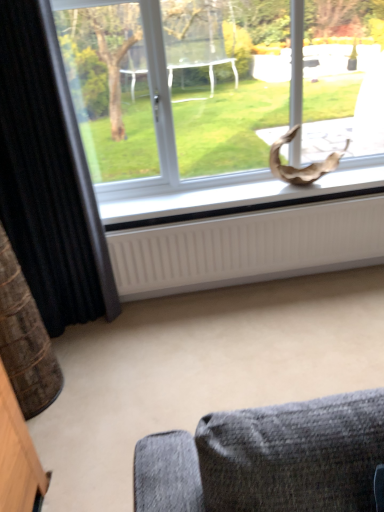
Question: From a real-world perspective, is white matte window sill at center positioned over transparent glass window at upper center based on gravity?

Choices:
 (A) yes
 (B) no

Answer: (B)

Question: Is white matte window sill at center surrounding transparent glass window at upper center?

Choices:
 (A) yes
 (B) no

Answer: (B)

Question: Does white matte window sill at center have a greater width compared to transparent glass window at upper center?

Choices:
 (A) yes
 (B) no

Answer: (B)

Question: From the image's perspective, is white matte window sill at center above transparent glass window at upper center?

Choices:
 (A) yes
 (B) no

Answer: (B)

Question: Considering the relative sizes of white matte window sill at center and transparent glass window at upper center in the image provided, is white matte window sill at center taller than transparent glass window at upper center?

Choices:
 (A) yes
 (B) no

Answer: (B)

Question: Is white ribbed radiator at lower center taller or shorter than black textured curtain at left?

Choices:
 (A) tall
 (B) short

Answer: (B)

Question: Is white ribbed radiator at lower center inside or outside of black textured curtain at left?

Choices:
 (A) outside
 (B) inside

Answer: (A)

Question: Is white ribbed radiator at lower center bigger or smaller than black textured curtain at left?

Choices:
 (A) big
 (B) small

Answer: (B)

Question: Is white ribbed radiator at lower center wider or thinner than black textured curtain at left?

Choices:
 (A) wide
 (B) thin

Answer: (B)

Question: Relative to transparent glass window at upper center, is white matte window sill at center in front or behind?

Choices:
 (A) behind
 (B) front

Answer: (A)

Question: Is point pos(365,172) closer or farther from the camera than point pos(157,90)?

Choices:
 (A) farther
 (B) closer

Answer: (A)

Question: From their relative heights in the image, would you say white matte window sill at center is taller or shorter than transparent glass window at upper center?

Choices:
 (A) tall
 (B) short

Answer: (B)

Question: From a real-world perspective, relative to transparent glass window at upper center, is white matte window sill at center vertically above or below?

Choices:
 (A) above
 (B) below

Answer: (B)

Question: From a real-world perspective, relative to transparent glass window at upper center, is black textured curtain at left vertically above or below?

Choices:
 (A) below
 (B) above

Answer: (A)

Question: Would you say black textured curtain at left is inside or outside transparent glass window at upper center?

Choices:
 (A) inside
 (B) outside

Answer: (B)